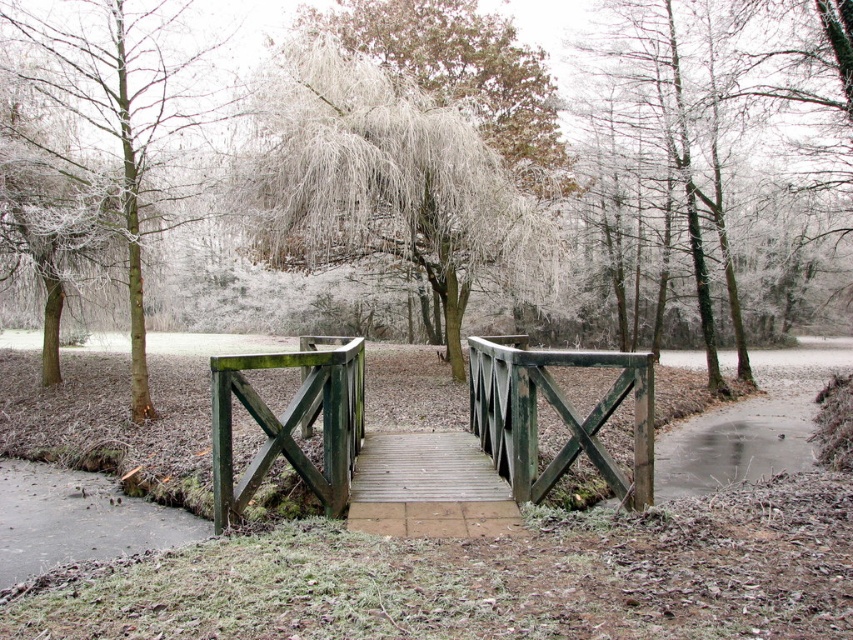
From the picture: Can you confirm if green wood bridge at center is taller than wooden bridge at center?

Yes.

Does green wood bridge at center have a lesser width compared to wooden bridge at center?

Indeed, green wood bridge at center has a lesser width compared to wooden bridge at center.

The width and height of the screenshot is (853, 640). Describe the element at coordinates (428, 438) in the screenshot. I see `green wood bridge at center` at that location.

Where is `green wood bridge at center`? The height and width of the screenshot is (640, 853). green wood bridge at center is located at coordinates (428, 438).

Between frosted wood tree at center and wooden bridge at center, which one has more height?

frosted wood tree at center is taller.

Is frosted wood tree at center to the left of wooden bridge at center from the viewer's perspective?

Correct, you'll find frosted wood tree at center to the left of wooden bridge at center.

Is point (386, 196) positioned behind point (396, 445)?

Yes.

Identify the location of frosted wood tree at center. (386, 180).

Is point (64, 16) more distant than point (431, 513)?

Yes, point (64, 16) is farther from viewer.

Find the location of a particular element. green wood tree at left is located at coordinates (120, 116).

Between point (158, 131) and point (363, 474), which one is positioned behind?

The point (158, 131) is more distant.

The width and height of the screenshot is (853, 640). In order to click on green wood tree at left in this screenshot , I will do coord(120,116).